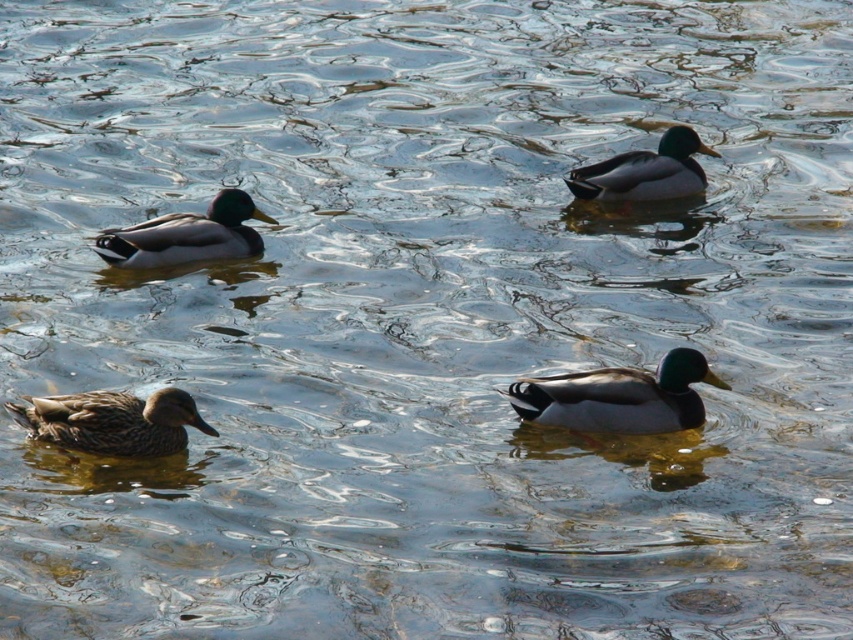
This screenshot has height=640, width=853. What do you see at coordinates (112, 420) in the screenshot?
I see `brown matte duck at lower left` at bounding box center [112, 420].

Is point (112, 392) more distant than point (653, 163)?

No, (112, 392) is in front of (653, 163).

Find the location of a particular element. The width and height of the screenshot is (853, 640). brown matte duck at lower left is located at coordinates (112, 420).

Is shiny brown duck at center bigger than brown matte duck at lower left?

Yes.

Which of these two, shiny brown duck at center or brown matte duck at lower left, stands shorter?

brown matte duck at lower left

Based on the photo, who is more distant from viewer, (668,412) or (38,438)?

Positioned behind is point (668,412).

Where is `shiny brown duck at center`? shiny brown duck at center is located at coordinates (619, 396).

Where is `brown matte duck at lower left`? brown matte duck at lower left is located at coordinates (112, 420).

Does brown matte duck at lower left have a lesser height compared to green glossy duck at left?

Indeed, brown matte duck at lower left has a lesser height compared to green glossy duck at left.

Is point (62, 422) closer to camera compared to point (167, 250)?

Yes, point (62, 422) is closer to viewer.

In order to click on brown matte duck at lower left in this screenshot , I will do `click(112, 420)`.